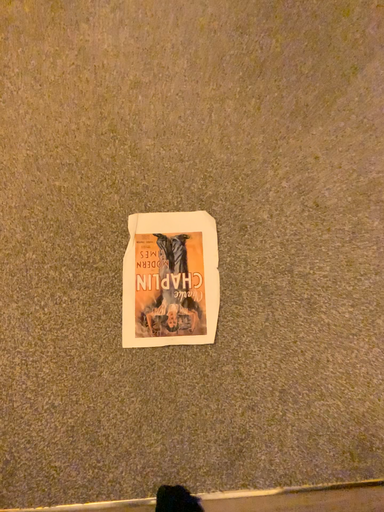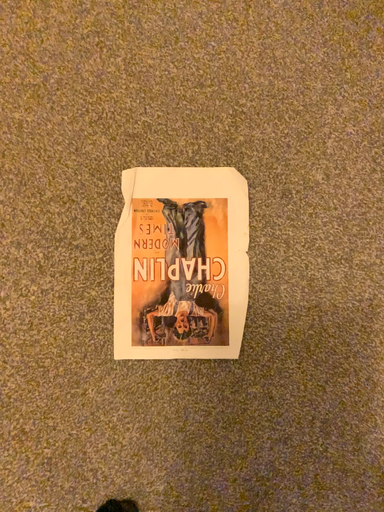
Question: Which way did the camera rotate in the video?

Choices:
 (A) rotated upward
 (B) rotated downward

Answer: (B)